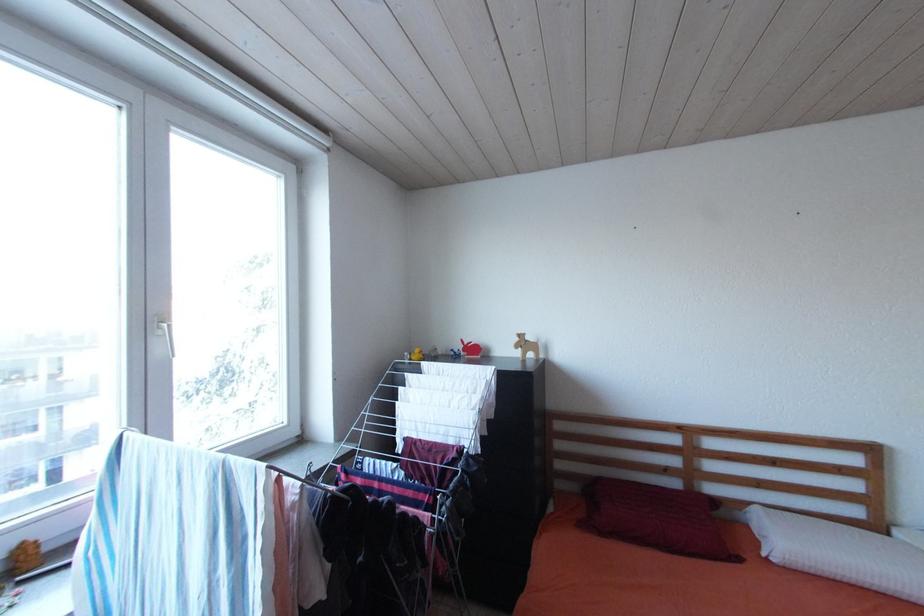
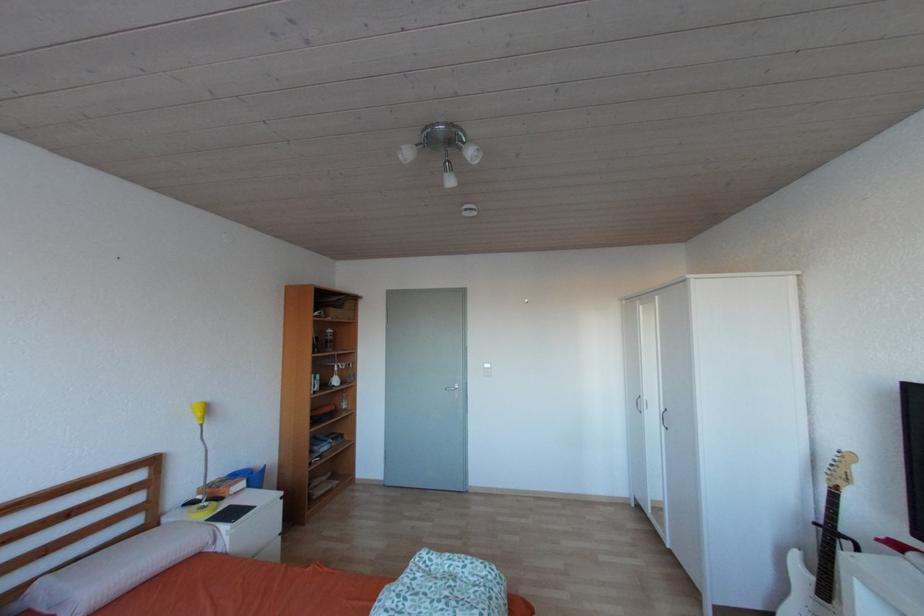
Question: Based on the continuous images, in which direction is the camera rotating? Reply with the corresponding letter.

Choices:
 (A) Left
 (B) Right
 (C) Up
 (D) Down

Answer: (B)